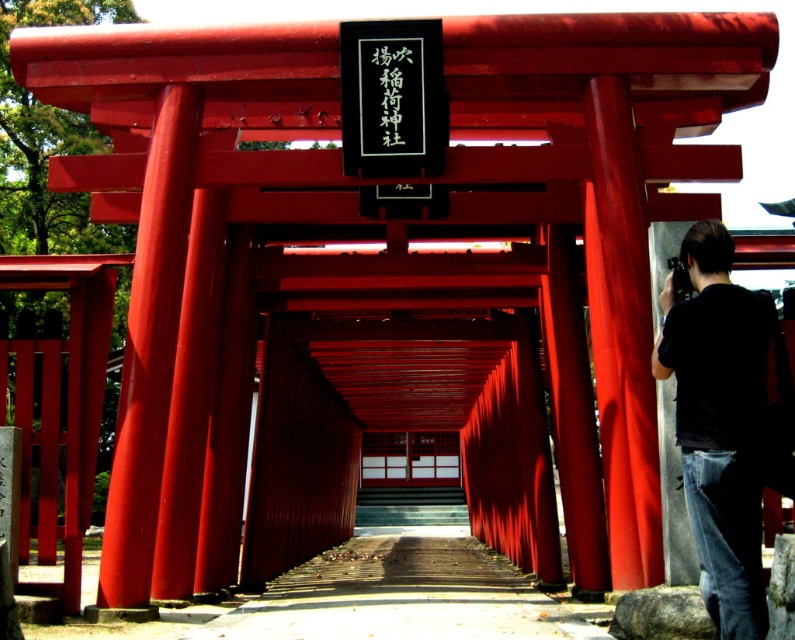
Between black cotton shirt at right and wooden planks at center, which one is positioned higher?

black cotton shirt at right is higher up.

Does black cotton shirt at right have a greater height compared to wooden planks at center?

No, black cotton shirt at right is not taller than wooden planks at center.

Locate an element on the screen. The height and width of the screenshot is (640, 795). black cotton shirt at right is located at coordinates (720, 422).